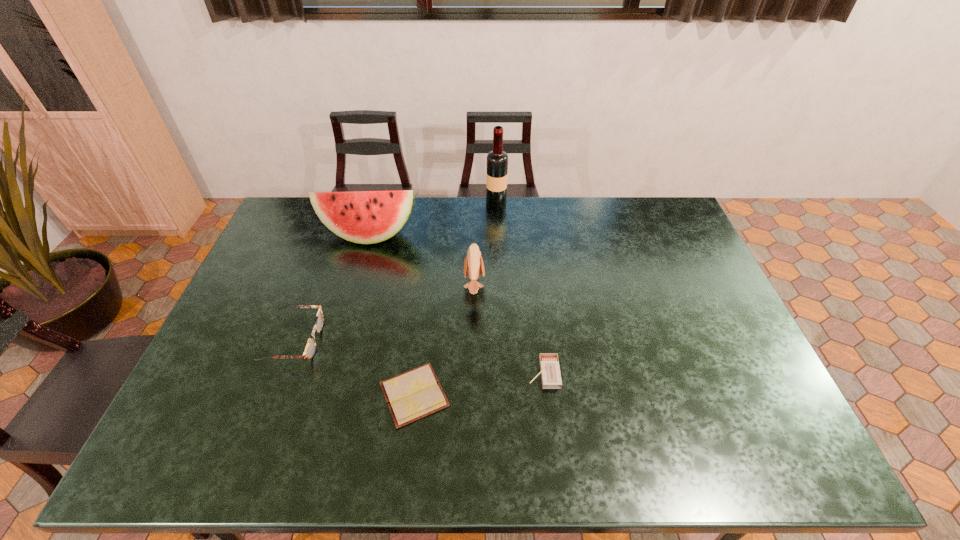
Locate an element on the screen. The width and height of the screenshot is (960, 540). free space between the fourth object from left to right and the spectacles is located at coordinates (384, 313).

Where is `free spot between the second shortest object and the fourth shortest object`? This screenshot has height=540, width=960. free spot between the second shortest object and the fourth shortest object is located at coordinates (509, 329).

Locate an element on the screen. The height and width of the screenshot is (540, 960). free spot between the farthest object and the spectacles is located at coordinates (395, 273).

Find the location of a particular element. The width and height of the screenshot is (960, 540). free area in between the matchbox and the watermelon is located at coordinates (456, 304).

You are a GUI agent. You are given a task and a screenshot of the screen. Output one action in this format:
    pyautogui.click(x=<x>, y=<y>)
    Task: Click on the vacant area between the tallest object and the third object from right to left
    The width and height of the screenshot is (960, 540).
    Given the screenshot: What is the action you would take?
    pyautogui.click(x=485, y=245)

At what (x,y) coordinates should I click in order to perform the action: click on vacant area between the second tallest object and the diary. Please return your answer as a coordinate pair (x, y). The width and height of the screenshot is (960, 540). Looking at the image, I should click on (392, 315).

This screenshot has width=960, height=540. I want to click on free space between the diary and the farthest object, so click(455, 300).

Image resolution: width=960 pixels, height=540 pixels. In order to click on vacant area that lies between the third shortest object and the matchbox in this screenshot , I will do `click(419, 357)`.

Locate an element on the screen. The image size is (960, 540). object that is the nearest to the farthest object is located at coordinates (366, 217).

I want to click on the closest object to the spectacles, so click(412, 395).